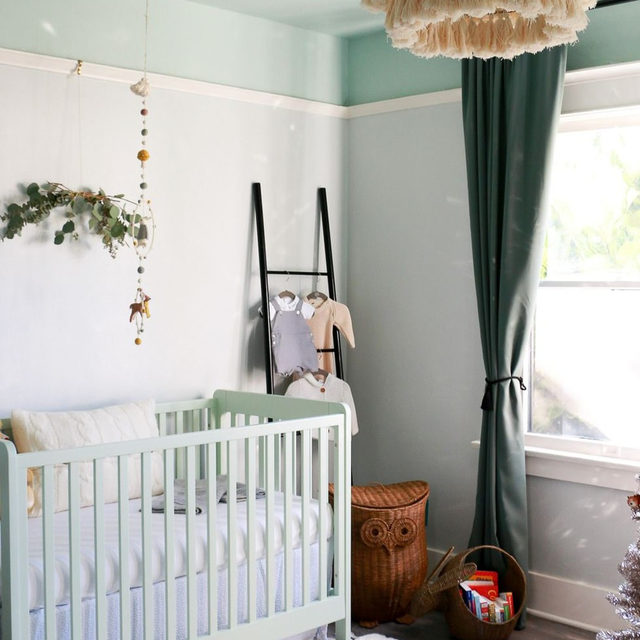
Identify the location of white side wall. point(438,269), point(160,303).